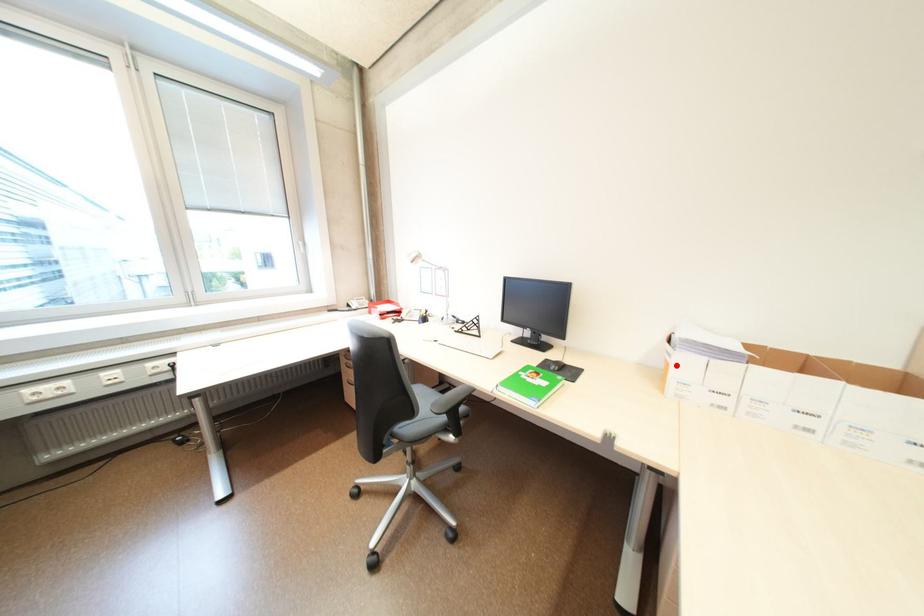
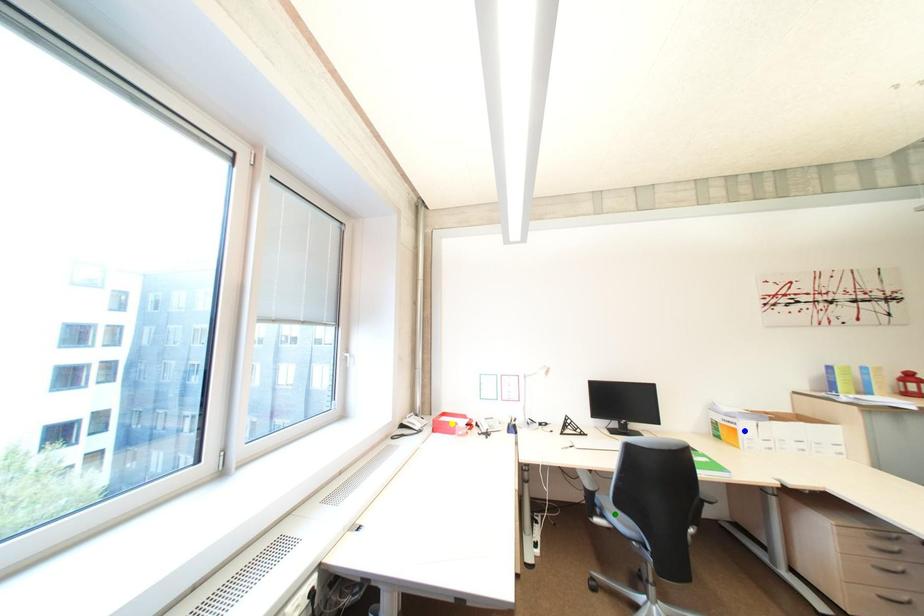
Question: I am providing you with two images of the same scene from different viewpoints. A red point is marked on the first image. You are given multiple points on the second image. In image 2, which mark is for the same physical point as the one in image 1?

Choices:
 (A) yellow point
 (B) green point
 (C) blue point

Answer: (C)